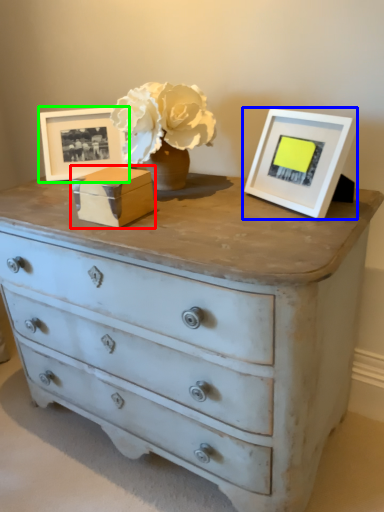
Question: Which object is the farthest from box (highlighted by a red box)? Choose among these: picture frame (highlighted by a blue box) or picture frame (highlighted by a green box).

Choices:
 (A) picture frame
 (B) picture frame

Answer: (A)